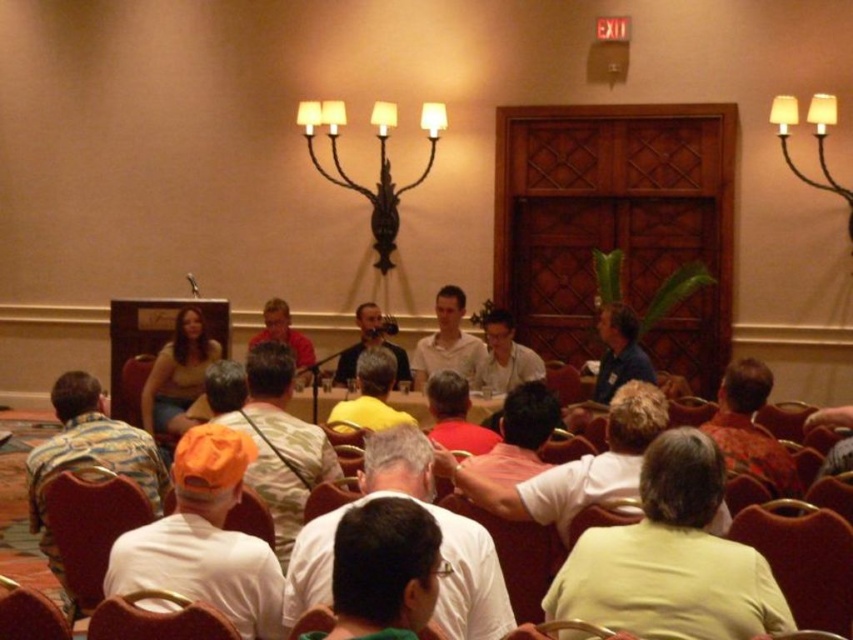
Is white matte cap at lower left above camouflage shirt at left?

Yes, white matte cap at lower left is above camouflage shirt at left.

From the picture: Between white matte cap at lower left and camouflage shirt at left, which one is positioned lower?

camouflage shirt at left is below.

Locate an element on the screen. This screenshot has height=640, width=853. white matte cap at lower left is located at coordinates (204, 540).

Does orange fabric turban at center appear over brown leather chair at lower left?

Yes, orange fabric turban at center is above brown leather chair at lower left.

From the picture: Is orange fabric turban at center to the left of brown leather chair at lower left from the viewer's perspective?

Result: No, orange fabric turban at center is not to the left of brown leather chair at lower left.

Is point (297, 444) positioned before point (202, 612)?

No.

Locate an element on the screen. This screenshot has width=853, height=640. orange fabric turban at center is located at coordinates (280, 444).

Which of these two, velvet red chair at lower left or matte black shirt at center, stands shorter?

velvet red chair at lower left is shorter.

Looking at this image, does velvet red chair at lower left appear over matte black shirt at center?

Actually, velvet red chair at lower left is below matte black shirt at center.

At what (x,y) coordinates should I click in order to perform the action: click on velvet red chair at lower left. Please return your answer as a coordinate pair (x, y). This screenshot has width=853, height=640. Looking at the image, I should click on (88, 529).

What are the coordinates of `velvet red chair at lower left` in the screenshot? It's located at (88, 529).